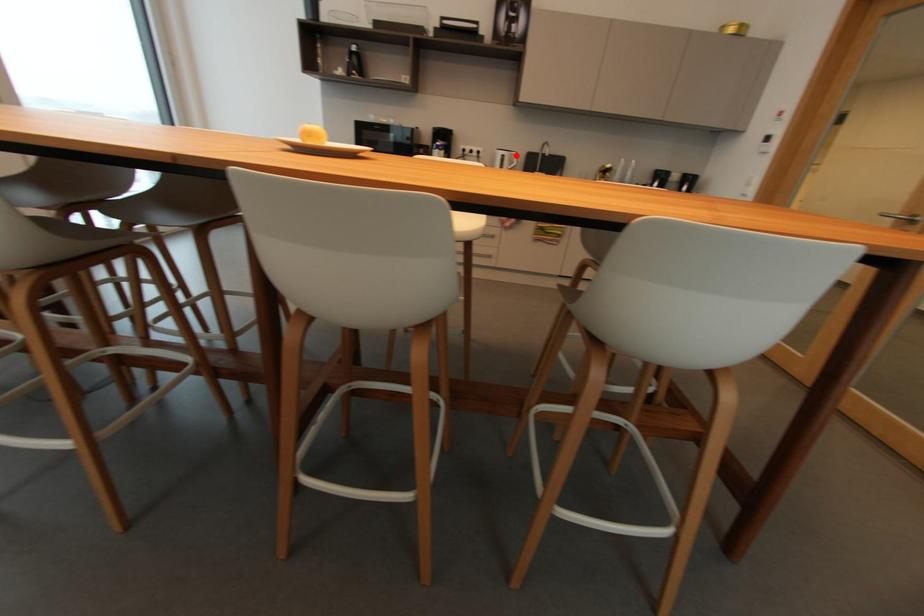
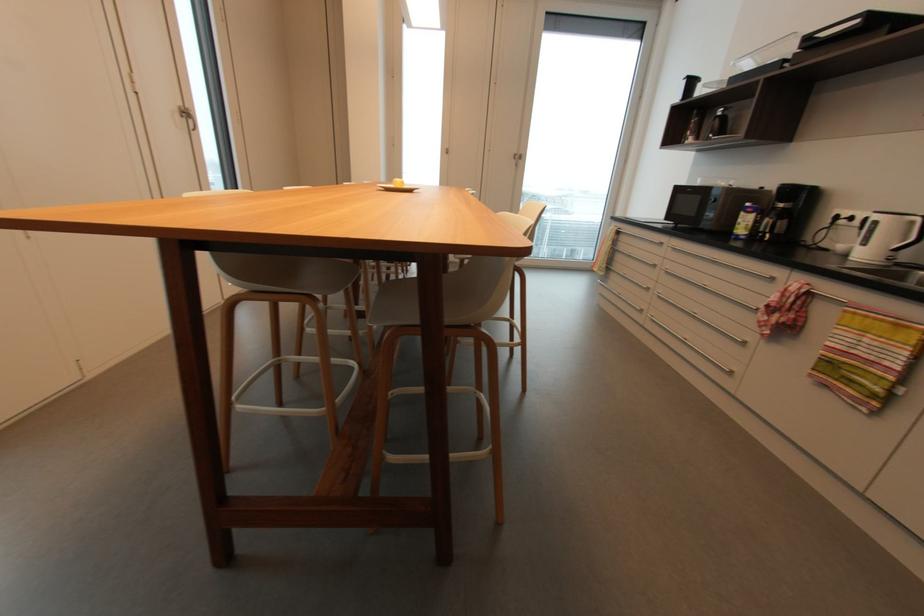
Question: I am providing you with two images of the same scene from different viewpoints. Given a red point in image1, look at the same physical point in image2. Is it:

Choices:
 (A) Closer to the viewpoint
 (B) Farther from the viewpoint

Answer: (B)